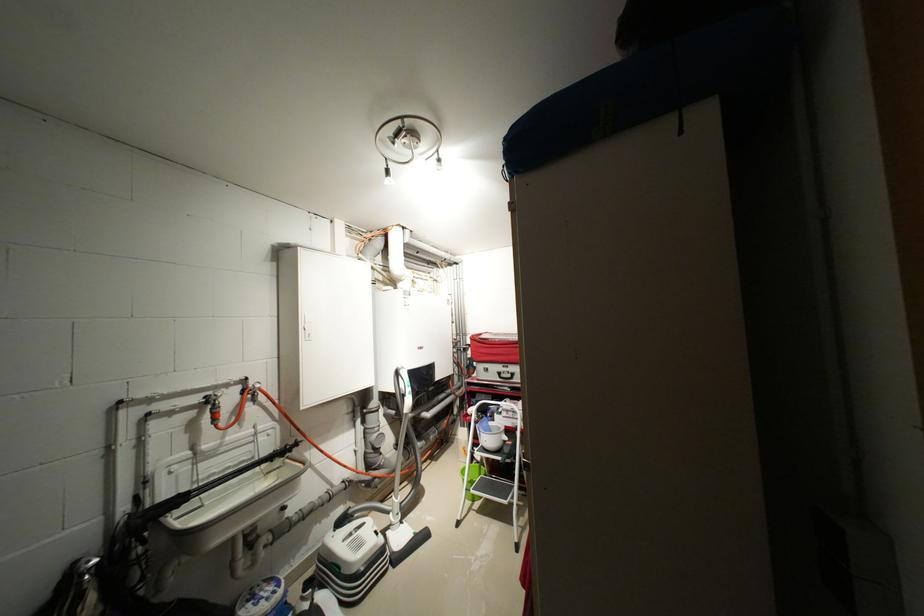
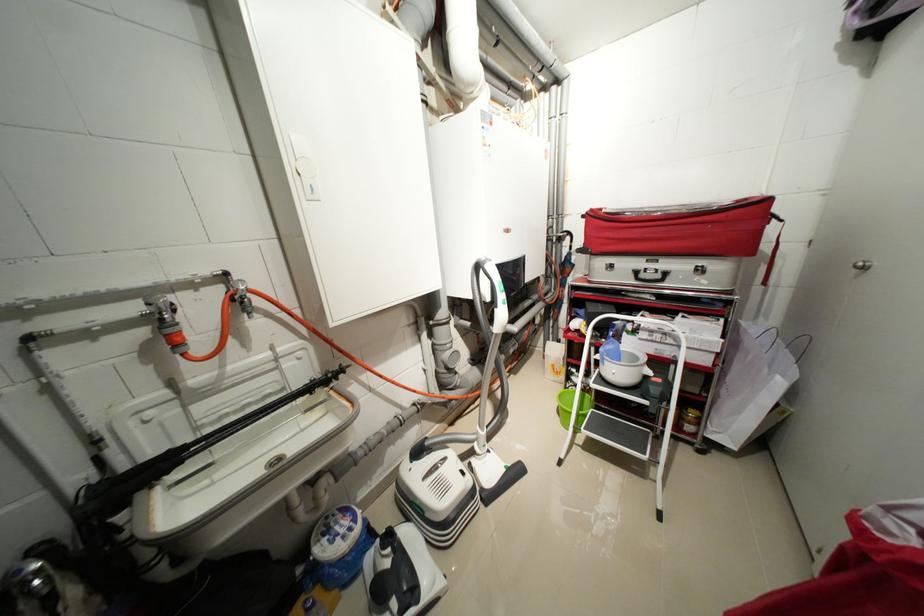
Question: How did the camera likely rotate?

Choices:
 (A) Left
 (B) Right
 (C) Up
 (D) Down

Answer: (D)